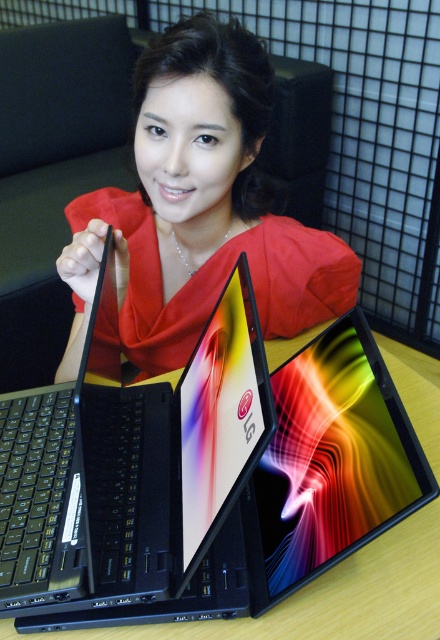
In the scene shown: You are a fashion designer looking at the image. You notice a point marked at coordinates (198, 209). What is the object located at this point?

The point at coordinates (198, 209) marks the matte red dress at center.

You are trying to place both the black matte laptop at center and the matte black tablet at center into a rectangular case that can only fit items with a combined width of up to 20 inches. If the laptop is wider than the tablet, what is the maximum possible width of the tablet to ensure they both fit?

If the black matte laptop at center is wider than the matte black tablet at center, then the maximum width of the tablet would be 20 inches minus the width of the laptop. However, without knowing the exact width of the laptop, we cannot determine the exact maximum width of the tablet.

You are an interior designer working on a project that requires precise placement of elements. You need to place a decorative item exactly at point (129,467) in the image. According to the scene, where would this point be located?

The point (129,467) is located on the black matte laptop at center.